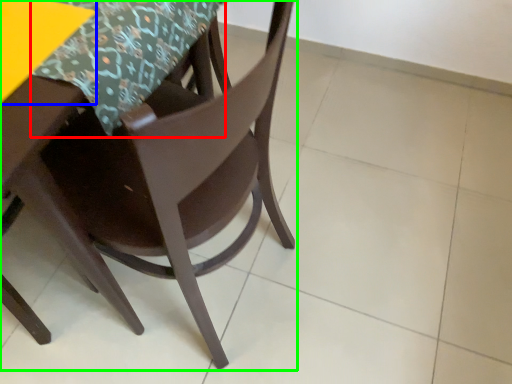
Question: Which is nearer to the tablecloth (highlighted by a red box)? table (highlighted by a blue box) or chair (highlighted by a green box).

Choices:
 (A) table
 (B) chair

Answer: (A)